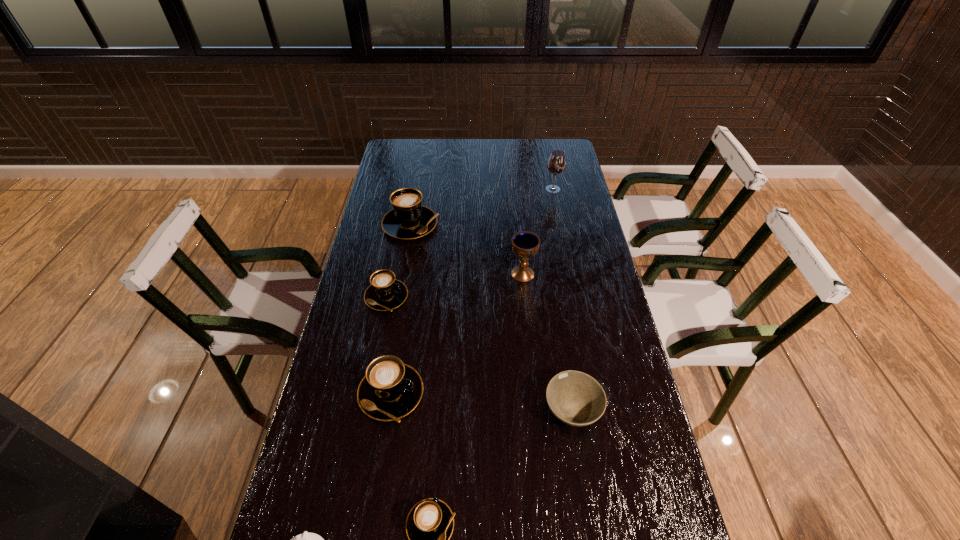
The height and width of the screenshot is (540, 960). What are the coordinates of `wineglass` in the screenshot? It's located at (556, 163).

I want to click on chalice, so click(x=524, y=244).

This screenshot has width=960, height=540. In order to click on the farthest black cappuccino in this screenshot , I will do `click(408, 219)`.

In order to click on the third tallest object in this screenshot , I will do `click(408, 219)`.

Where is `the fourth tallest object`? The width and height of the screenshot is (960, 540). the fourth tallest object is located at coordinates (390, 390).

Identify the location of the second tallest cappuccino. (390, 390).

Locate an element on the screen. This screenshot has height=540, width=960. the second farthest cappuccino is located at coordinates (385, 293).

The height and width of the screenshot is (540, 960). I want to click on the third nearest black cappuccino, so click(x=385, y=293).

What are the coordinates of `bowl` in the screenshot? It's located at (575, 398).

You are a GUI agent. You are given a task and a screenshot of the screen. Output one action in this format:
    pyautogui.click(x=<x>, y=<y>)
    Task: Click on the blank space located 0.070m on the left of the farthest object
    The width and height of the screenshot is (960, 540).
    Given the screenshot: What is the action you would take?
    pyautogui.click(x=527, y=189)